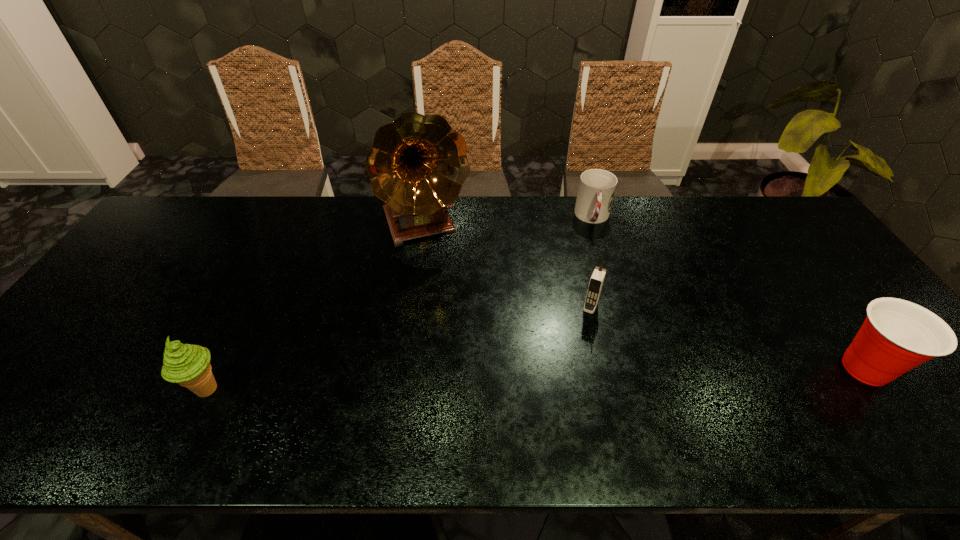
This screenshot has width=960, height=540. Identify the location of vacant spot on the desktop that is between the icecream and the right cup and is positioned on the side of the shortest object where the handle is located. (605, 377).

Identify the location of vacant space on the desktop that is between the icecream and the right cup and is positioned on the front-facing side of the third nearest object. Image resolution: width=960 pixels, height=540 pixels. click(561, 379).

Locate an element on the screen. This screenshot has width=960, height=540. vacant space on the desktop that is between the icecream and the taller cup and is positioned on the horn of the phonograph_record is located at coordinates (488, 381).